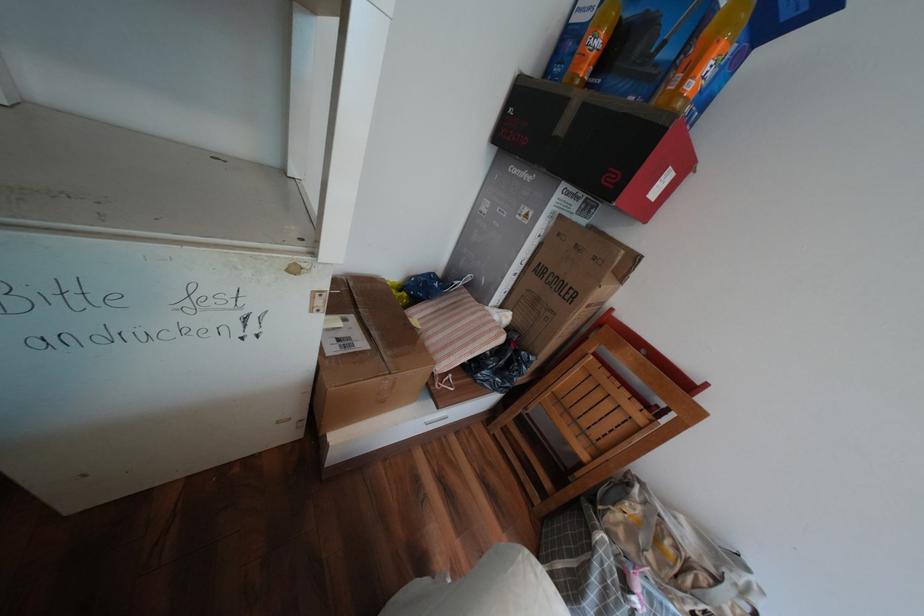
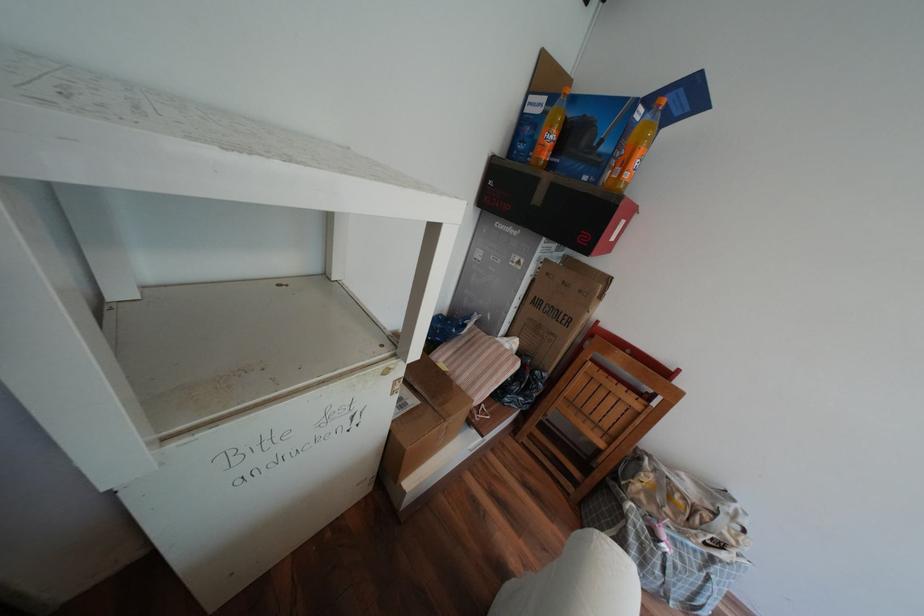
Locate, in the second image, the point that corresponds to [609,26] in the first image.

(561, 127)